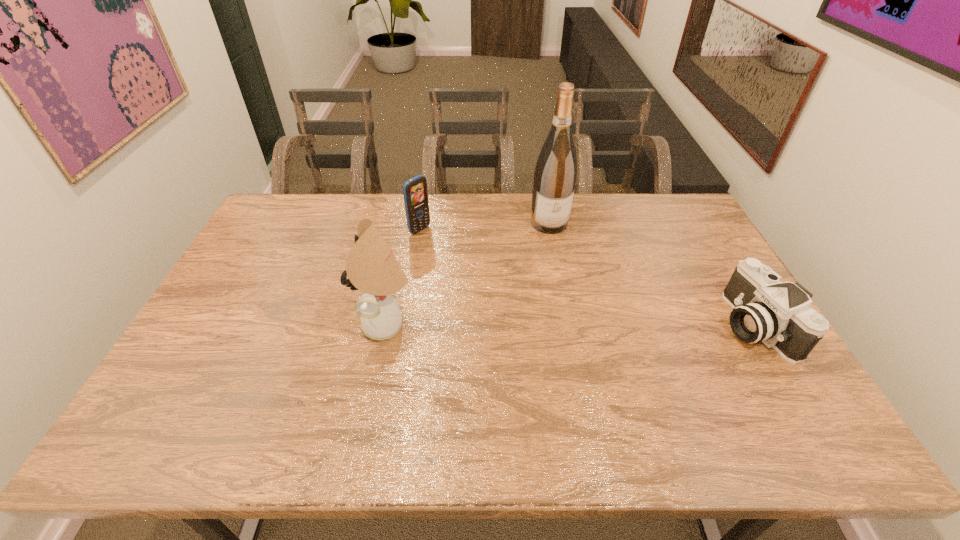
The width and height of the screenshot is (960, 540). In order to click on vacant position at the near edge of the desktop in this screenshot , I will do `click(640, 406)`.

In the image, there is a desktop. Where is `vacant space at the left edge`? The image size is (960, 540). vacant space at the left edge is located at coordinates (216, 363).

Locate an element on the screen. The height and width of the screenshot is (540, 960). free space at the right edge of the desktop is located at coordinates (721, 287).

Where is `vacant area at the far left corner of the desktop`? The width and height of the screenshot is (960, 540). vacant area at the far left corner of the desktop is located at coordinates (304, 207).

You are a GUI agent. You are given a task and a screenshot of the screen. Output one action in this format:
    pyautogui.click(x=<x>, y=<y>)
    Task: Click on the free space at the far right corner of the desktop
    This screenshot has height=540, width=960.
    Given the screenshot: What is the action you would take?
    pyautogui.click(x=673, y=206)

At what (x,y) coordinates should I click in order to perform the action: click on free space at the near right corner of the desktop. Please return your answer as a coordinate pair (x, y). This screenshot has height=540, width=960. Looking at the image, I should click on (762, 376).

Identify the location of free spot between the third tallest object and the wine bottle. (485, 227).

The width and height of the screenshot is (960, 540). I want to click on vacant region between the second object from right to left and the doll, so click(x=468, y=274).

Image resolution: width=960 pixels, height=540 pixels. I want to click on free area in between the shortest object and the wine bottle, so click(651, 274).

I want to click on free space between the second tallest object and the tallest object, so click(x=468, y=274).